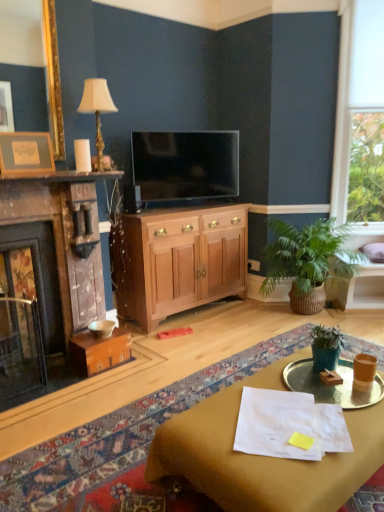
Find the location of `free space that is to the left of green woven basket at right, which is the second houseplant in front-to-back order`. free space that is to the left of green woven basket at right, which is the second houseplant in front-to-back order is located at coordinates (226, 326).